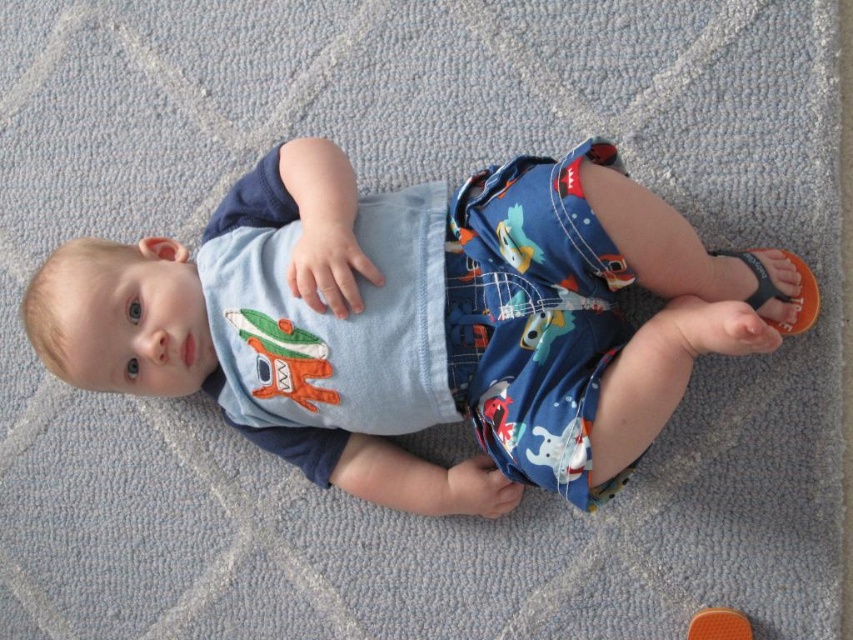
Question: Which object is positioned farthest from the blue cotton baby at center?

Choices:
 (A) printed cotton diaper at center
 (B) orange flip-flop at lower right

Answer: (B)

Question: Which object appears farthest from the camera in this image?

Choices:
 (A) blue cotton baby at center
 (B) printed cotton diaper at center

Answer: (B)

Question: Is blue cotton baby at center above printed cotton diaper at center?

Choices:
 (A) no
 (B) yes

Answer: (A)

Question: Does blue cotton baby at center lie in front of orange flip-flop at lower right?

Choices:
 (A) no
 (B) yes

Answer: (B)

Question: Does printed cotton diaper at center appear on the right side of orange flip-flop at lower right?

Choices:
 (A) yes
 (B) no

Answer: (B)

Question: Which of the following is the farthest from the observer?

Choices:
 (A) printed cotton diaper at center
 (B) orange flip-flop at lower right
 (C) blue cotton baby at center

Answer: (B)